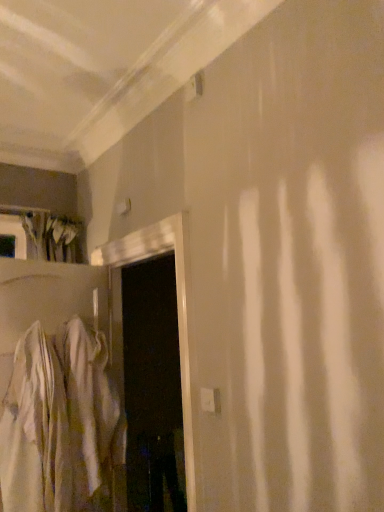
Question: In terms of width, does white glossy door at center look wider or thinner when compared to white cotton robe at left?

Choices:
 (A) wide
 (B) thin

Answer: (A)

Question: Visually, is white glossy door at center positioned to the left or to the right of white cotton robe at left?

Choices:
 (A) right
 (B) left

Answer: (A)

Question: Is point (130, 248) closer or farther from the camera than point (39, 495)?

Choices:
 (A) closer
 (B) farther

Answer: (B)

Question: From the image's perspective, is white cotton robe at left located above or below white glossy door at center?

Choices:
 (A) above
 (B) below

Answer: (B)

Question: Is white cotton robe at left situated inside white glossy door at center or outside?

Choices:
 (A) inside
 (B) outside

Answer: (B)

Question: From a real-world perspective, relative to white glossy door at center, is white cotton robe at left vertically above or below?

Choices:
 (A) above
 (B) below

Answer: (B)

Question: Considering the positions of point (104, 385) and point (183, 342), is point (104, 385) closer or farther from the camera than point (183, 342)?

Choices:
 (A) farther
 (B) closer

Answer: (A)